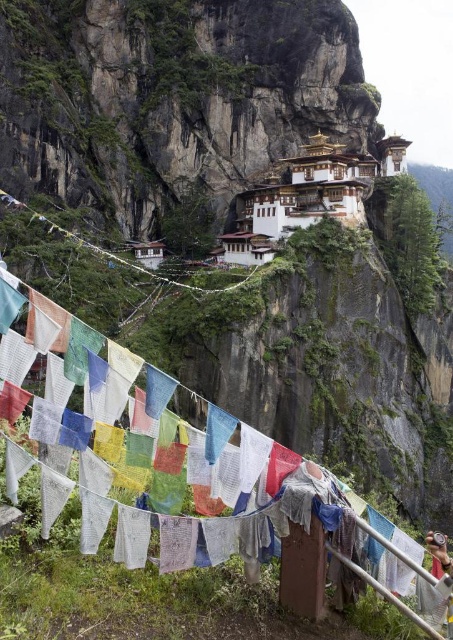
You are a visitor at the Taktsang Monastery and want to take a photo of the white painted stone building at upper center without any obstructions. Is the colorful fabric clothesline at lower center blocking your view of it?

The colorful fabric clothesline at lower center is positioned under the white painted stone building at upper center, so it is below the building and would not block the view of the white painted stone building at upper center.

You are a photographer planning to take a photo of the white painted stone building at upper center and the colorful fabric clothesline at lower center. Which object should you focus on first to ensure both are in sharp focus?

The colorful fabric clothesline at lower center is closer to the viewer than the white painted stone building at upper center. To ensure both are in sharp focus, you should focus on the closer object, which is the colorful fabric clothesline at lower center.